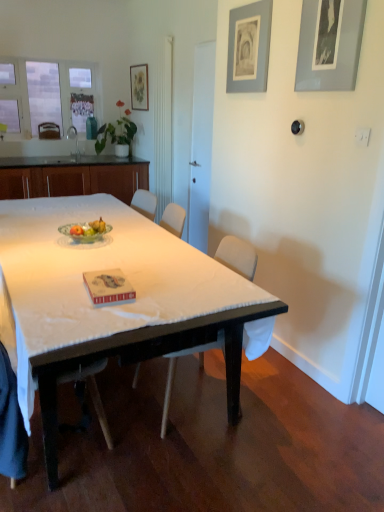
Describe the element at coordinates (113, 305) in the screenshot. The width and height of the screenshot is (384, 512). I see `white matte table at center` at that location.

What is the approximate width of green glass bowl at center?

9.94 inches.

What do you see at coordinates (72, 177) in the screenshot? The image size is (384, 512). I see `wooden cabinet at left` at bounding box center [72, 177].

The height and width of the screenshot is (512, 384). Describe the element at coordinates (49, 130) in the screenshot. I see `wooden at left, which ranks as the first chair in back-to-front order` at that location.

Measure the distance between clear glass window at upper left and camera.

clear glass window at upper left and camera are 5.65 meters apart.

The width and height of the screenshot is (384, 512). In order to click on white plastic chair at center, the first chair from the right in this screenshot , I will do `click(237, 256)`.

Based on the photo, from the image's perspective, which one is positioned lower, white plastic chair at center, the first chair from the right, or wooden cabinet at left?

white plastic chair at center, the first chair from the right, appears lower in the image.

Considering the sizes of objects white plastic chair at center, arranged as the second chair when viewed from the top, and wooden cabinet at left in the image provided, who is smaller, white plastic chair at center, arranged as the second chair when viewed from the top, or wooden cabinet at left?

white plastic chair at center, arranged as the second chair when viewed from the top, is smaller.

Can you tell me how much white plastic chair at center, the 2th chair ordered from the bottom, and wooden cabinet at left differ in facing direction?

The angle between the facing direction of white plastic chair at center, the 2th chair ordered from the bottom, and the facing direction of wooden cabinet at left is 93.4 degrees.

Considering the relative positions of white plastic chair at center, arranged as the second chair when viewed from the top, and wooden cabinet at left in the image provided, is white plastic chair at center, arranged as the second chair when viewed from the top, to the right of wooden cabinet at left from the viewer's perspective?

Correct, you'll find white plastic chair at center, arranged as the second chair when viewed from the top, to the right of wooden cabinet at left.

In the scene shown: Is clear glass window at upper left thinner than wooden at left, positioned as the 3th chair in front-to-back order?

Yes.

Based on their sizes in the image, would you say clear glass window at upper left is bigger or smaller than wooden at left, which is the 3th chair in bottom-to-top order?

clear glass window at upper left is bigger than wooden at left, which is the 3th chair in bottom-to-top order.

Considering the relative positions of clear glass window at upper left and wooden at left, arranged as the first chair when viewed from the top, in the image provided, is clear glass window at upper left in front of wooden at left, arranged as the first chair when viewed from the top,?

Yes, the depth of clear glass window at upper left is less than that of wooden at left, arranged as the first chair when viewed from the top.

From a real-world perspective, which is physically below, wooden at left, placed as the 1th chair when sorted from left to right, or white wood chair at center, the 2th chair in the left-to-right sequence?

white wood chair at center, the 2th chair in the left-to-right sequence, from a real-world perspective.

Is wooden at left, arranged as the first chair when viewed from the top, smaller than white wood chair at center, the 1th chair in the front-to-back sequence?

Indeed, wooden at left, arranged as the first chair when viewed from the top, has a smaller size compared to white wood chair at center, the 1th chair in the front-to-back sequence.

How different are the orientations of wooden at left, marked as the 3th chair in a right-to-left arrangement, and white wood chair at center, the 1th chair in the front-to-back sequence, in degrees?

90.9 degrees separate the facing orientations of wooden at left, marked as the 3th chair in a right-to-left arrangement, and white wood chair at center, the 1th chair in the front-to-back sequence.

Looking at their sizes, would you say wooden at left, which is the 3th chair in bottom-to-top order, is wider or thinner than white wood chair at center, marked as the third chair in a back-to-front arrangement?

In the image, wooden at left, which is the 3th chair in bottom-to-top order, appears to be more narrow than white wood chair at center, marked as the third chair in a back-to-front arrangement.

This screenshot has height=512, width=384. In the image, there is a green glass bowl at center. Find the location of `table below it (from a real-world perspective)`. table below it (from a real-world perspective) is located at coordinates (113, 305).

Which of these two, green glass bowl at center or white matte table at center, is smaller?

With smaller size is green glass bowl at center.

Is green glass bowl at center not within white matte table at center?

Yes, green glass bowl at center is outside of white matte table at center.

Is green glass bowl at center in front of or behind white matte table at center in the image?

green glass bowl at center is positioned farther from the viewer than white matte table at center.

Between white matte table at center and wooden cabinet at left, which one appears on the right side from the viewer's perspective?

Positioned to the right is white matte table at center.

Is point (193, 342) less distant than point (140, 187)?

That is True.

Is white matte table at center shorter than wooden cabinet at left?

Yes.

Considering the sizes of white matte table at center and wooden cabinet at left in the image, is white matte table at center wider or thinner than wooden cabinet at left?

In the image, white matte table at center appears to be wider than wooden cabinet at left.

From a real-world perspective, is gray matte picture frame at upper right, the first picture frame viewed from the front, located beneath white wood chair at center, the 2th chair in the left-to-right sequence?

No.

Is gray matte picture frame at upper right, the first picture frame viewed from the front, turned away from white wood chair at center, marked as the third chair in a back-to-front arrangement?

No.

Is gray matte picture frame at upper right, acting as the 3th picture frame starting from the back, wider or thinner than white wood chair at center, marked as the third chair in a back-to-front arrangement?

Considering their sizes, gray matte picture frame at upper right, acting as the 3th picture frame starting from the back, looks slimmer than white wood chair at center, marked as the third chair in a back-to-front arrangement.

From a real-world perspective, relative to clear glass window at upper left, is white matte table at center vertically above or below?

Clearly, from a real-world perspective, white matte table at center is below clear glass window at upper left.

Is white matte table at center situated inside clear glass window at upper left or outside?

white matte table at center is located beyond the bounds of clear glass window at upper left.

Does white matte table at center appear on the right side of clear glass window at upper left?

Yes, white matte table at center is to the right of clear glass window at upper left.

Which is farther, [120,259] or [11,97]?

Positioned behind is point [11,97].

Where is `cabinetry lying above the white plastic chair at center, which ranks as the third chair in left-to-right order (from the image's perspective)`? The width and height of the screenshot is (384, 512). cabinetry lying above the white plastic chair at center, which ranks as the third chair in left-to-right order (from the image's perspective) is located at coordinates (72, 177).

Locate an element on the screen. window screen in front of the wooden at left, marked as the 3th chair in a right-to-left arrangement is located at coordinates (50, 92).

Based on their spatial positions, is white plastic chair at center, which is counted as the second chair, starting from the front, or white wood chair at center, the 2th chair in the left-to-right sequence, closer to clear glass window at upper left?

white plastic chair at center, which is counted as the second chair, starting from the front.

When comparing their distances from matte gray picture frame at upper right, which is the second picture frame from top to bottom, does white plastic chair at center, which is counted as the second chair, starting from the front, or matte floral print picture frame at upper center, marked as the 3th picture frame in a front-to-back arrangement, seem further?

matte floral print picture frame at upper center, marked as the 3th picture frame in a front-to-back arrangement.

Considering their positions, is green glass bowl at center positioned further to matte gray picture frame at upper right, arranged as the second picture frame when viewed from the back, than clear glass window at upper left?

clear glass window at upper left is further to matte gray picture frame at upper right, arranged as the second picture frame when viewed from the back.

From the picture: Looking at the image, which one is located further to matte gray picture frame at upper right, which appears as the second picture frame when viewed from the right, green glass bowl at center or gray matte picture frame at upper right, which appears as the 3th picture frame when viewed from the top?

green glass bowl at center is positioned further to the anchor matte gray picture frame at upper right, which appears as the second picture frame when viewed from the right.

When comparing their distances from wooden at left, placed as the 1th chair when sorted from left to right, does white matte table at center or green glass bowl at center seem closer?

green glass bowl at center is positioned closer to the anchor wooden at left, placed as the 1th chair when sorted from left to right.

Estimate the real-world distances between objects in this image. Which object is closer to green glass bowl at center, clear glass window at upper left or wooden cabinet at left?

Among the two, wooden cabinet at left is located nearer to green glass bowl at center.

Estimate the real-world distances between objects in this image. Which object is further from white plastic chair at center, arranged as the second chair when viewed from the top, wooden cabinet at left or gray matte picture frame at upper right, the 1th picture frame from the right?

wooden cabinet at left is positioned further to the anchor white plastic chair at center, arranged as the second chair when viewed from the top.

Consider the image. Based on their spatial positions, is clear glass window at upper left or green glass bowl at center further from wooden cabinet at left?

green glass bowl at center is further to wooden cabinet at left.

Image resolution: width=384 pixels, height=512 pixels. I want to click on picture frame that lies between matte gray picture frame at upper right, which appears as the second picture frame when viewed from the right, and white wood chair at center, placed as the second chair when sorted from right to left, from top to bottom, so click(329, 44).

Where is `cabinetry located between white matte table at center and matte floral print picture frame at upper center, marked as the 3th picture frame in a front-to-back arrangement, in the depth direction`? cabinetry located between white matte table at center and matte floral print picture frame at upper center, marked as the 3th picture frame in a front-to-back arrangement, in the depth direction is located at coordinates click(x=72, y=177).

I want to click on fruit dish positioned between white matte table at center and clear glass window at upper left from near to far, so click(84, 236).

Where is `cabinetry between gray matte picture frame at upper right, positioned as the 1th picture frame in bottom-to-top order, and wooden at left, which is the 3th chair in bottom-to-top order, from front to back`? The height and width of the screenshot is (512, 384). cabinetry between gray matte picture frame at upper right, positioned as the 1th picture frame in bottom-to-top order, and wooden at left, which is the 3th chair in bottom-to-top order, from front to back is located at coordinates (72, 177).